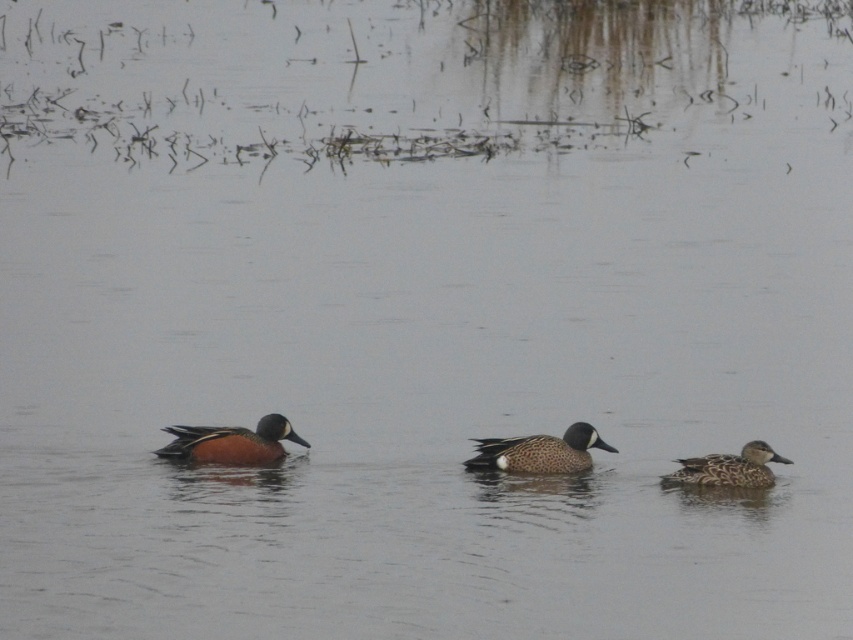
Question: Which object is farther from the camera taking this photo?

Choices:
 (A) speckled feathered duck at center
 (B) blue speckled duck at left

Answer: (A)

Question: Which object is positioned closest to the blue speckled duck at left?

Choices:
 (A) speckled feathered duck at center
 (B) speckled brown duck at right

Answer: (A)

Question: Can you confirm if blue speckled duck at left is positioned to the right of speckled feathered duck at center?

Choices:
 (A) yes
 (B) no

Answer: (B)

Question: Among these objects, which one is farthest from the camera?

Choices:
 (A) speckled feathered duck at center
 (B) blue speckled duck at left
 (C) speckled brown duck at right

Answer: (A)

Question: Does blue speckled duck at left come in front of speckled brown duck at right?

Choices:
 (A) no
 (B) yes

Answer: (B)

Question: Does blue speckled duck at left appear over speckled feathered duck at center?

Choices:
 (A) yes
 (B) no

Answer: (A)